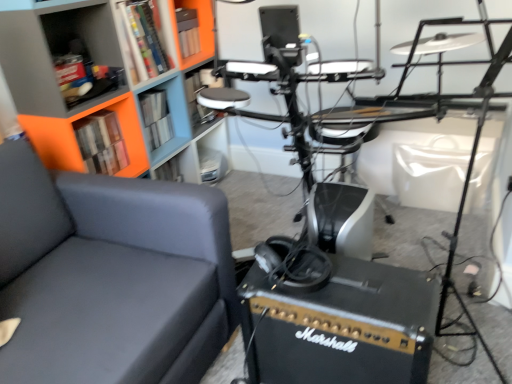
The height and width of the screenshot is (384, 512). What are the coordinates of `hardcover book at upper left, arranged as the 1th book when viewed from the front` in the screenshot? It's located at (101, 143).

Is gray fabric couch at left surrounding orange matte bookcase at upper left?

No, orange matte bookcase at upper left is not a part of gray fabric couch at left.

Which of these two, gray fabric couch at left or orange matte bookcase at upper left, stands shorter?

gray fabric couch at left is shorter.

Considering the positions of points (184, 382) and (122, 52), is point (184, 382) farther from camera compared to point (122, 52)?

No, (184, 382) is in front of (122, 52).

Considering the positions of points (111, 131) and (106, 55), is point (111, 131) farther from camera compared to point (106, 55)?

Yes, it is behind point (106, 55).

From a real-world perspective, relative to matte plastic shelf at upper left, the 2th shelf in the back-to-front sequence, is hardcover book at upper left, arranged as the 1th book when viewed from the front, vertically above or below?

In terms of real-world spatial position, hardcover book at upper left, arranged as the 1th book when viewed from the front, is below matte plastic shelf at upper left, the 2th shelf in the back-to-front sequence.

Visually, is hardcover book at upper left, arranged as the 1th book when viewed from the front, positioned to the left or to the right of matte plastic shelf at upper left, the 2th shelf in the back-to-front sequence?

From the image, it's evident that hardcover book at upper left, arranged as the 1th book when viewed from the front, is to the right of matte plastic shelf at upper left, the 2th shelf in the back-to-front sequence.

From the image's perspective, between hardcover book at upper left, arranged as the 1th book when viewed from the front, and matte plastic shelf at upper left, arranged as the 2th shelf when viewed from the right, which one is located above?

From the image's view, matte plastic shelf at upper left, arranged as the 2th shelf when viewed from the right, is above.

Consider the image. Considering the relative positions of black matte marshall amplifier at lower right and matte plastic shelf at upper left, arranged as the 2th shelf when viewed from the right, in the image provided, is black matte marshall amplifier at lower right to the left of matte plastic shelf at upper left, arranged as the 2th shelf when viewed from the right, from the viewer's perspective?

No.

From the image's perspective, which is above, black matte marshall amplifier at lower right or matte plastic shelf at upper left, the 2th shelf in the back-to-front sequence?

matte plastic shelf at upper left, the 2th shelf in the back-to-front sequence, from the image's perspective.

Which of these two, black matte marshall amplifier at lower right or matte plastic shelf at upper left, acting as the first shelf starting from the front, is wider?

Wider between the two is black matte marshall amplifier at lower right.

From the picture: Does black matte marshall amplifier at lower right come in front of matte plastic shelf at upper left, acting as the first shelf starting from the front?

Yes, black matte marshall amplifier at lower right is closer to the viewer.

From a real-world perspective, is hardcover book at upper left, the 2th book from the front, physically above black matte marshall amplifier at lower right?

Yes, from a real-world perspective, hardcover book at upper left, the 2th book from the front, is above black matte marshall amplifier at lower right.

Considering the relative sizes of hardcover book at upper left, which ranks as the 1th book in back-to-front order, and black matte marshall amplifier at lower right in the image provided, is hardcover book at upper left, which ranks as the 1th book in back-to-front order, shorter than black matte marshall amplifier at lower right?

Indeed, hardcover book at upper left, which ranks as the 1th book in back-to-front order, has a lesser height compared to black matte marshall amplifier at lower right.

Is hardcover book at upper left, the 2th book from the front, facing towards black matte marshall amplifier at lower right?

No, hardcover book at upper left, the 2th book from the front, does not turn towards black matte marshall amplifier at lower right.

The image size is (512, 384). I want to click on book that is on the left side of orange matte bookcase at upper left, so click(101, 143).

Is the depth of orange matte bookcase at upper left greater than that of hardcover book at upper left, which is counted as the second book, starting from the back?

No.

Consider the image. Which is correct: orange matte bookcase at upper left is inside hardcover book at upper left, arranged as the 1th book when viewed from the front, or outside of it?

orange matte bookcase at upper left is not inside hardcover book at upper left, arranged as the 1th book when viewed from the front, it's outside.

From the picture: From the image's perspective, which one is positioned higher, orange matte bookcase at upper left or hardcover book at upper left, which is counted as the second book, starting from the back?

orange matte bookcase at upper left.

From the image's perspective, between gray fabric couch at left and black matte marshall amplifier at lower right, which one is located above?

gray fabric couch at left appears higher in the image.

Which object is thinner, gray fabric couch at left or black matte marshall amplifier at lower right?

With smaller width is black matte marshall amplifier at lower right.

Which is in front, gray fabric couch at left or black matte marshall amplifier at lower right?

gray fabric couch at left is in front.

Which of these two, gray fabric couch at left or black matte marshall amplifier at lower right, stands shorter?

Standing shorter between the two is black matte marshall amplifier at lower right.

At what (x,y) coordinates should I click in order to perform the action: click on shelf above the matte plastic shelf at center, the 2th shelf when ordered from left to right (from a real-world perspective). Please return your answer as a coordinate pair (x, y). Image resolution: width=512 pixels, height=384 pixels. Looking at the image, I should click on (61, 56).

Is matte plastic shelf at center, the 2th shelf when ordered from left to right, to the left or to the right of matte plastic shelf at upper left, the 1th shelf in the left-to-right sequence, in the image?

matte plastic shelf at center, the 2th shelf when ordered from left to right, is to the right of matte plastic shelf at upper left, the 1th shelf in the left-to-right sequence.

Is matte plastic shelf at center, the 2th shelf when ordered from left to right, bigger or smaller than matte plastic shelf at upper left, the 2th shelf in the back-to-front sequence?

In the image, matte plastic shelf at center, the 2th shelf when ordered from left to right, appears to be smaller than matte plastic shelf at upper left, the 2th shelf in the back-to-front sequence.

Between matte plastic shelf at center, placed as the first shelf when sorted from back to front, and matte plastic shelf at upper left, the 2th shelf in the back-to-front sequence, which one has smaller width?

matte plastic shelf at center, placed as the first shelf when sorted from back to front, is thinner.

Image resolution: width=512 pixels, height=384 pixels. Find the location of `bookcase above the gray fabric couch at left (from a real-world perspective)`. bookcase above the gray fabric couch at left (from a real-world perspective) is located at coordinates (98, 64).

From the image's perspective, count 1st shelfs upward from the hardcover book at upper left, arranged as the 1th book when viewed from the front, and point to it. Please provide its 2D coordinates.

[(61, 56)]

Looking at this image, when comparing their distances from hardcover book at upper left, which ranks as the 1th book in back-to-front order, does hardcover book at upper left, which is counted as the second book, starting from the back, or gray fabric couch at left seem closer?

hardcover book at upper left, which is counted as the second book, starting from the back, is positioned closer to the anchor hardcover book at upper left, which ranks as the 1th book in back-to-front order.

Estimate the real-world distances between objects in this image. Which object is further from black matte marshall amplifier at lower right, hardcover book at upper left, which ranks as the 1th book in back-to-front order, or hardcover book at upper left, which is counted as the second book, starting from the back?

Based on the image, hardcover book at upper left, which ranks as the 1th book in back-to-front order, appears to be further to black matte marshall amplifier at lower right.

From the image, which object appears to be nearer to matte plastic shelf at upper left, the 2th shelf in the back-to-front sequence, hardcover book at upper left, arranged as the 1th book when viewed from the front, or gray fabric couch at left?

Based on the image, hardcover book at upper left, arranged as the 1th book when viewed from the front, appears to be nearer to matte plastic shelf at upper left, the 2th shelf in the back-to-front sequence.

Which object lies further to the anchor point orange matte bookcase at upper left, hardcover book at upper left, which is counted as the second book, starting from the back, or matte plastic shelf at upper left, the 2th shelf in the back-to-front sequence?

hardcover book at upper left, which is counted as the second book, starting from the back, is positioned further to the anchor orange matte bookcase at upper left.

When comparing their distances from matte plastic shelf at upper left, the 2th shelf in the back-to-front sequence, does hardcover book at upper left, which is counted as the second book, starting from the back, or hardcover book at upper left, the 2th book from the front, seem further?

hardcover book at upper left, the 2th book from the front, is further to matte plastic shelf at upper left, the 2th shelf in the back-to-front sequence.

Considering their positions, is orange matte bookcase at upper left positioned further to gray fabric couch at left than black matte marshall amplifier at lower right?

orange matte bookcase at upper left.

Looking at the image, which one is located closer to orange matte bookcase at upper left, hardcover book at upper left, which ranks as the 1th book in back-to-front order, or matte plastic shelf at upper left, the 1th shelf in the left-to-right sequence?

matte plastic shelf at upper left, the 1th shelf in the left-to-right sequence.

Looking at this image, looking at the image, which one is located further to hardcover book at upper left, which is counted as the second book, starting from the back, matte plastic shelf at upper left, the 2th shelf in the back-to-front sequence, or orange matte bookcase at upper left?

The object further to hardcover book at upper left, which is counted as the second book, starting from the back, is matte plastic shelf at upper left, the 2th shelf in the back-to-front sequence.

Where is `bookcase between matte plastic shelf at upper left, the 1th shelf in the left-to-right sequence, and black matte marshall amplifier at lower right, in the horizontal direction`? The height and width of the screenshot is (384, 512). bookcase between matte plastic shelf at upper left, the 1th shelf in the left-to-right sequence, and black matte marshall amplifier at lower right, in the horizontal direction is located at coordinates (98, 64).

You are a GUI agent. You are given a task and a screenshot of the screen. Output one action in this format:
    pyautogui.click(x=<x>, y=<y>)
    Task: Click on the equipment between gray fabric couch at left and hardcover book at upper left, the 2th book from the front, from front to back
    This screenshot has height=384, width=512.
    Given the screenshot: What is the action you would take?
    pyautogui.click(x=333, y=317)

Find the location of a particular element. book between orange matte bookcase at upper left and hardcover book at upper left, the 2th book from the front, in the front-back direction is located at coordinates (101, 143).

You are a GUI agent. You are given a task and a screenshot of the screen. Output one action in this format:
    pyautogui.click(x=<x>, y=<y>)
    Task: Click on the bookcase between black matte marshall amplifier at lower right and matte plastic shelf at center, which is the 1th shelf from right to left, along the z-axis
    This screenshot has width=512, height=384.
    Given the screenshot: What is the action you would take?
    click(x=98, y=64)